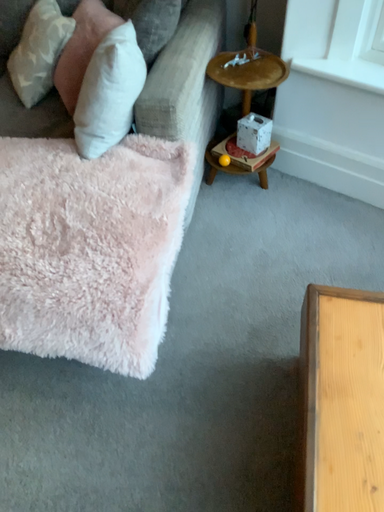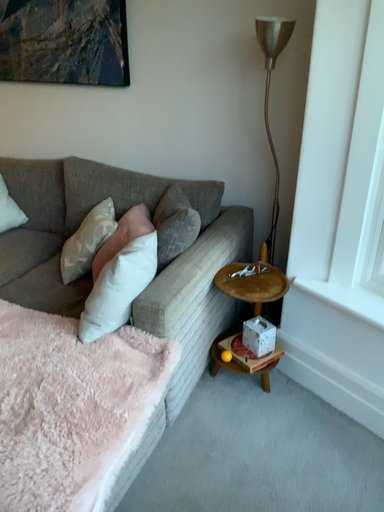
Question: How did the camera likely rotate when shooting the video?

Choices:
 (A) rotated upward
 (B) rotated downward

Answer: (A)